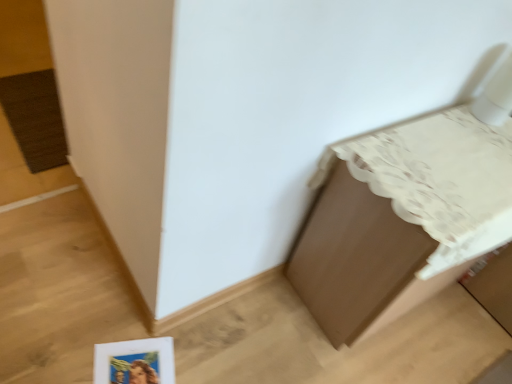
Question: Should I look upward or downward to see brown matte cabinet at upper right?

Choices:
 (A) up
 (B) down

Answer: (B)